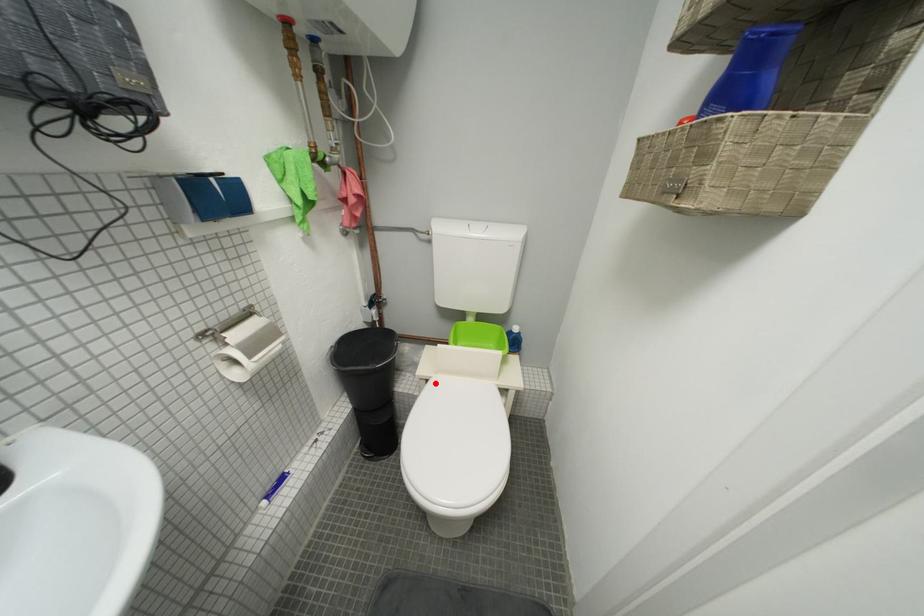
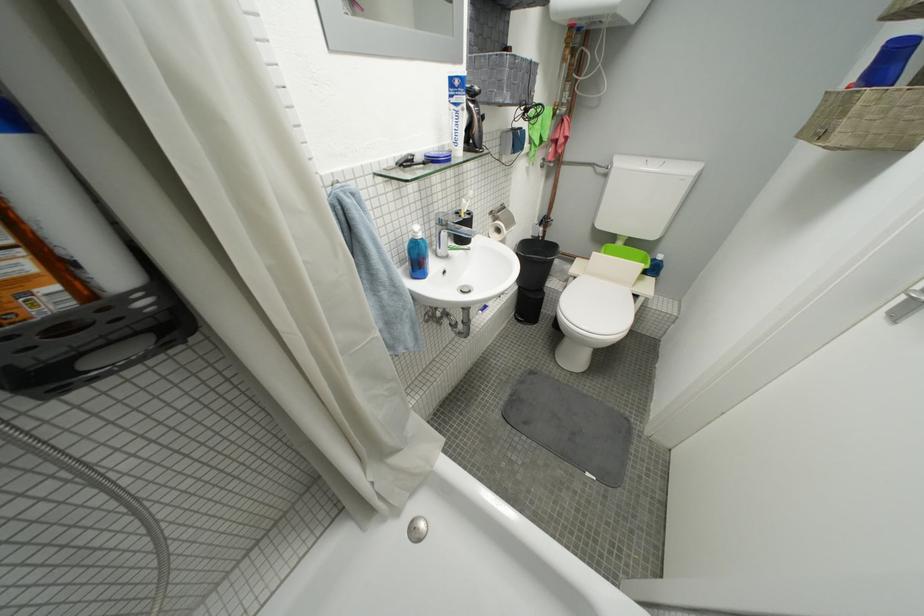
Question: I am providing you with two images of the same scene from different viewpoints. Image1 has a red point marked. In image2, the corresponding 3D location appears at what relative position? Reply with the corresponding letter.

Choices:
 (A) Closer
 (B) Farther

Answer: (A)